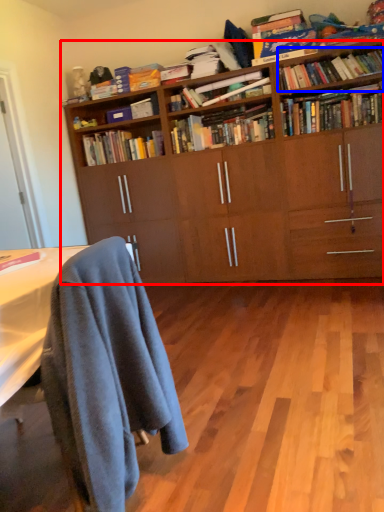
Question: Which point is closer to the camera, bookcase (highlighted by a red box) or book (highlighted by a blue box)?

Choices:
 (A) bookcase
 (B) book

Answer: (A)